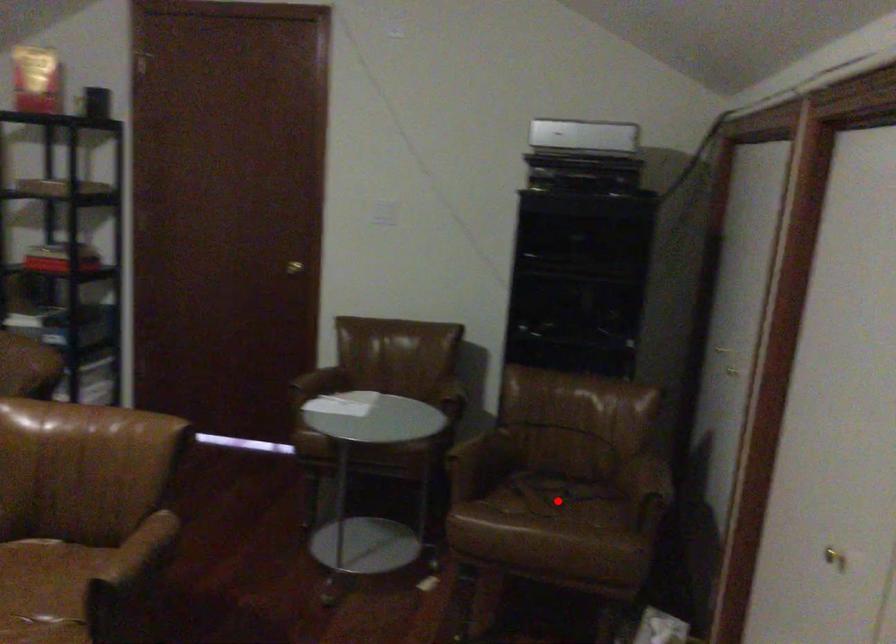
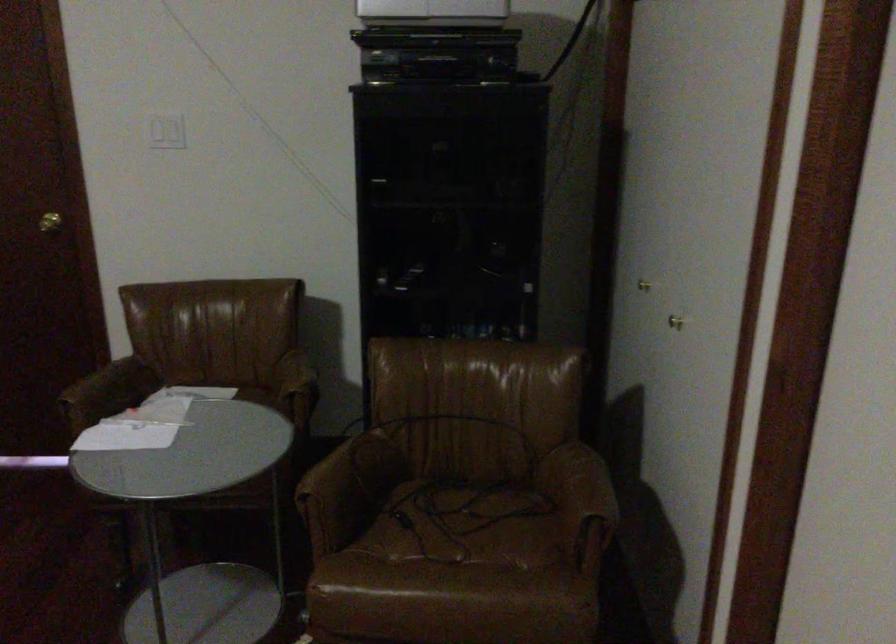
In the second image, find the point that corresponds to the highlighted location in the first image.

(464, 525)